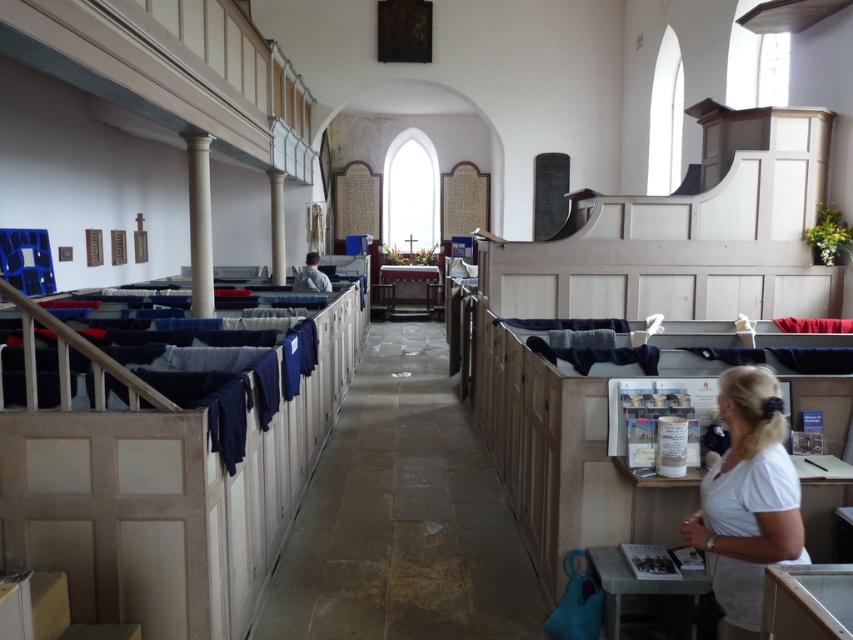
Can you confirm if white cotton shirt at lower right is shorter than white polished column at center?

Yes, white cotton shirt at lower right is shorter than white polished column at center.

Is point (757, 628) positioned after point (277, 234)?

No, (757, 628) is closer to viewer.

Which is behind, point (795, 529) or point (271, 253)?

Positioned behind is point (271, 253).

Identify the location of white cotton shirt at lower right. The image size is (853, 640). (747, 499).

Does white cotton shirt at lower right appear on the right side of light blue fabric at center?

Indeed, white cotton shirt at lower right is positioned on the right side of light blue fabric at center.

Is white cotton shirt at lower right positioned behind light blue fabric at center?

No, white cotton shirt at lower right is in front of light blue fabric at center.

What are the coordinates of `white cotton shirt at lower right` in the screenshot? It's located at (747, 499).

You are a GUI agent. You are given a task and a screenshot of the screen. Output one action in this format:
    pyautogui.click(x=<x>, y=<y>)
    Task: Click on the white cotton shirt at lower right
    The height and width of the screenshot is (640, 853).
    Given the screenshot: What is the action you would take?
    pyautogui.click(x=747, y=499)

Does white polished column at center have a lesser height compared to light blue fabric at center?

No.

Is white polished column at center taller than light blue fabric at center?

Yes.

Where is `white polished column at center`? white polished column at center is located at coordinates (277, 227).